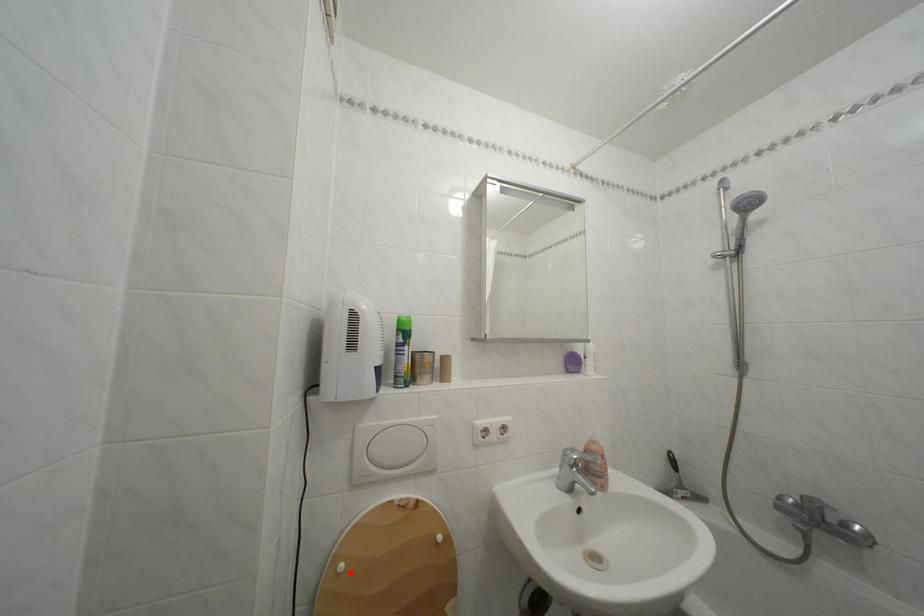
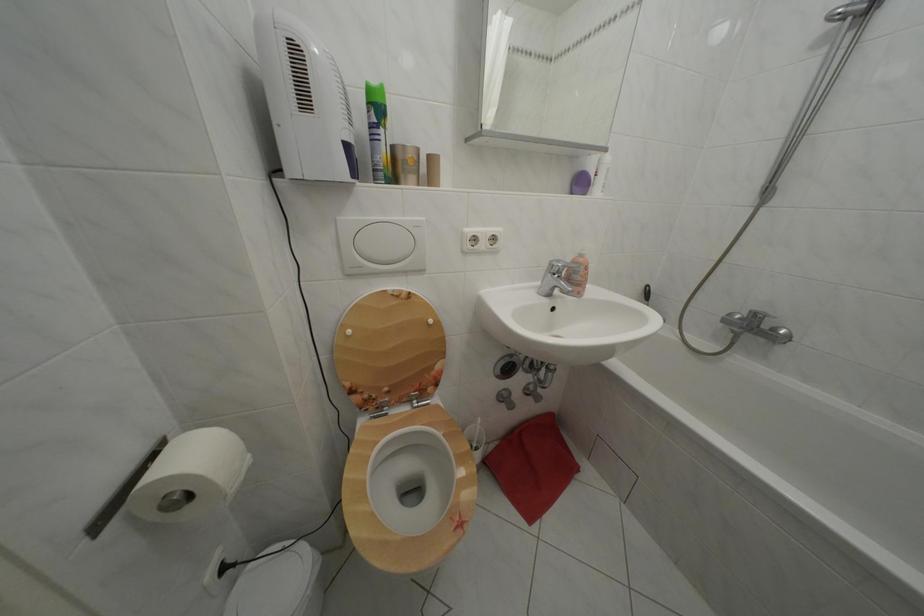
In the second image, find the point that corresponds to the highlighted location in the first image.

(358, 338)